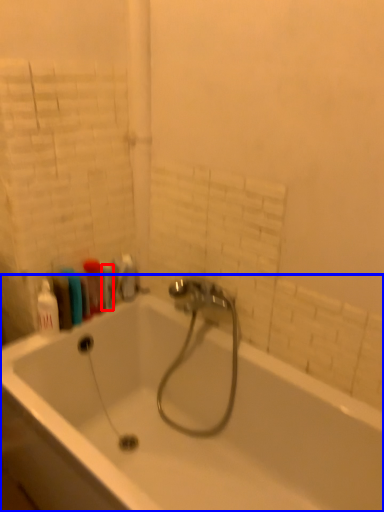
Question: Which point is further to the camera, toiletry (highlighted by a red box) or bathtub (highlighted by a blue box)?

Choices:
 (A) toiletry
 (B) bathtub

Answer: (A)